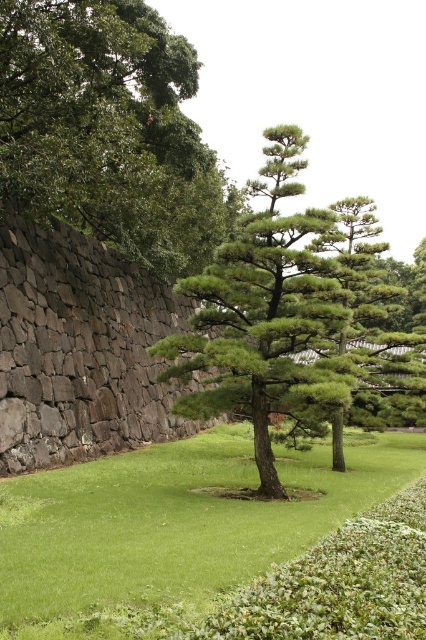
Question: Is green leafy tree at upper left closer to camera compared to green needle-like at center?

Choices:
 (A) no
 (B) yes

Answer: (A)

Question: Is green leafy tree at upper left thinner than green textured pine tree at center?

Choices:
 (A) no
 (B) yes

Answer: (B)

Question: Which object is farther from the camera taking this photo?

Choices:
 (A) green needle-like at center
 (B) green grass at center
 (C) green leafy tree at upper left

Answer: (C)

Question: Can you confirm if green leafy tree at upper left is positioned below green needle-like at center?

Choices:
 (A) yes
 (B) no

Answer: (B)

Question: Which object is the farthest from the green leafy tree at upper left?

Choices:
 (A) green needle-like at center
 (B) green grass at center
 (C) green textured pine tree at center

Answer: (B)

Question: Which point is farther to the camera?

Choices:
 (A) green needle-like at center
 (B) green leafy tree at upper left
 (C) green grass at center
 (D) green textured pine tree at center

Answer: (B)